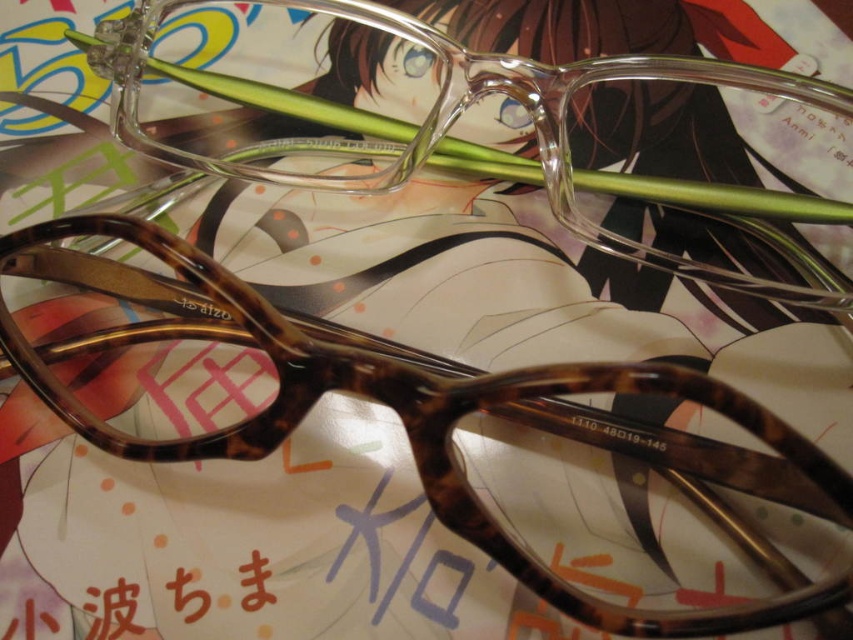
Question: Is tortoiseshell acetate glasses at center thinner than tortoiseshell plastic glasses at center?

Choices:
 (A) yes
 (B) no

Answer: (A)

Question: Does tortoiseshell acetate glasses at center lie behind tortoiseshell plastic glasses at center?

Choices:
 (A) yes
 (B) no

Answer: (B)

Question: Does tortoiseshell acetate glasses at center appear on the left side of tortoiseshell plastic glasses at center?

Choices:
 (A) no
 (B) yes

Answer: (B)